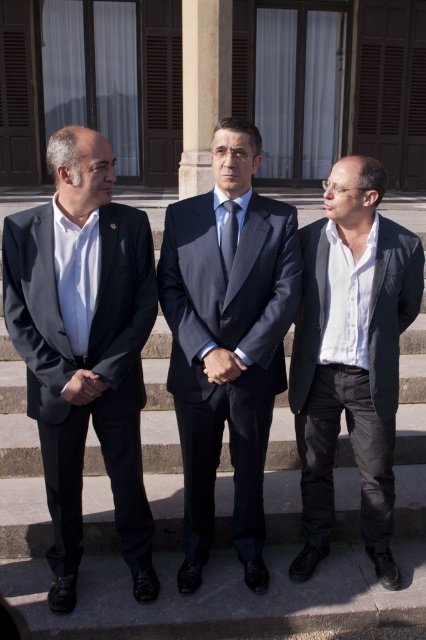
You are standing at the base of the stone steps in front of the building. You see two points marked on the steps. The first point is at coordinate point [221,388] and the second point is at coordinate point [331,468]. If you were to walk towards the building, which point would you reach first?

Point [221,388] is in front of point [331,468], so you would reach point [221,388] first as you walk towards the building.

You are a photographer standing behind the three men on the stone steps. You need to capture a photo where the matte black suit at left and the gray concrete stairs at center are both clearly visible. Considering their heights, which object will appear taller in the photo?

The matte black suit at left will appear taller in the photo because it has a greater height compared to the gray concrete stairs at center according to the description.